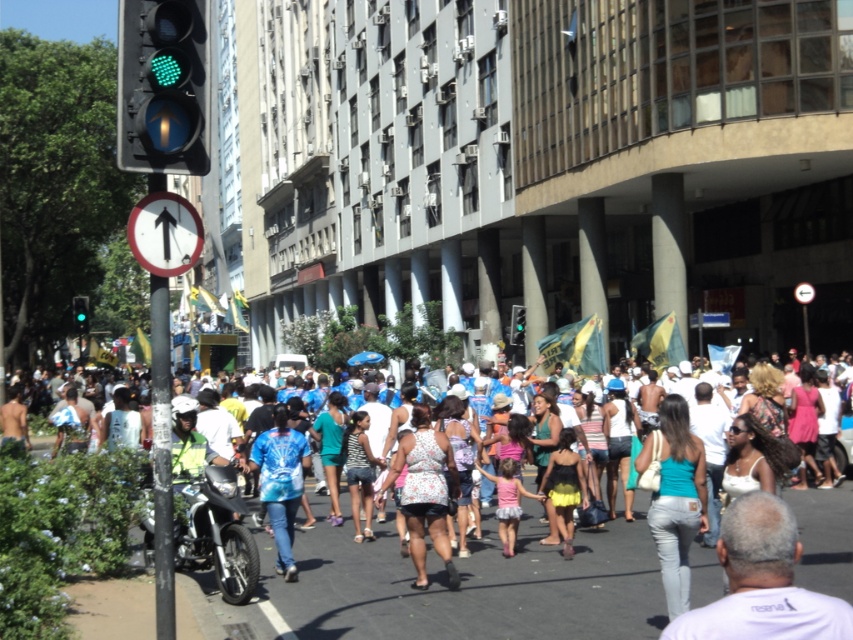
You are a pedestrian standing at the crosswalk near the traffic light. You see a white matte shirt at lower right and a shiny black motorcycle at lower left. Which object is closer to the traffic light?

The white matte shirt at lower right is closer to the traffic light because it is shorter than the shiny black motorcycle at lower left, meaning it is positioned nearer to the traffic light.